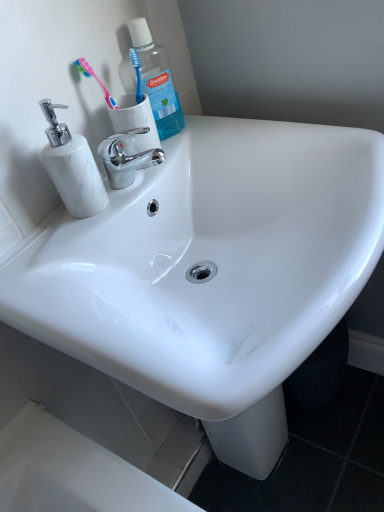
Measure the distance between white glossy sink at center and camera.

white glossy sink at center and camera are 16.32 inches apart from each other.

Locate an element on the screen. chrome/metallic faucet at center is located at coordinates [x=127, y=156].

Is white glossy sink at center positioned behind white marble soap dispenser at left?

No, it is in front of white marble soap dispenser at left.

Considering the relative sizes of white glossy sink at center and white marble soap dispenser at left in the image provided, is white glossy sink at center smaller than white marble soap dispenser at left?

Incorrect, white glossy sink at center is not smaller in size than white marble soap dispenser at left.

How many degrees apart are the facing directions of white glossy sink at center and white marble soap dispenser at left?

The facing directions of white glossy sink at center and white marble soap dispenser at left are 1.76 degrees apart.

From a real-world perspective, which is physically below, white glossy sink at center or white marble soap dispenser at left?

white glossy sink at center is physically lower.

From a real-world perspective, is blue translucent plastic mouthwash at upper left physically above white marble soap dispenser at left?

Yes, from a real-world perspective, blue translucent plastic mouthwash at upper left is above white marble soap dispenser at left.

From the image's perspective, does blue translucent plastic mouthwash at upper left appear lower than white marble soap dispenser at left?

Incorrect, from the image's perspective, blue translucent plastic mouthwash at upper left is higher than white marble soap dispenser at left.

At what (x,y) coordinates should I click in order to perform the action: click on cleaning product on the right of the white marble soap dispenser at left. Please return your answer as a coordinate pair (x, y). This screenshot has height=512, width=384. Looking at the image, I should click on (157, 80).

Can you confirm if blue translucent plastic mouthwash at upper left is wider than white marble soap dispenser at left?

No.

Considering the sizes of pink plastic toothbrush at upper left and chrome/metallic faucet at center in the image, is pink plastic toothbrush at upper left bigger or smaller than chrome/metallic faucet at center?

Clearly, pink plastic toothbrush at upper left is smaller in size than chrome/metallic faucet at center.

From the image's perspective, is pink plastic toothbrush at upper left located beneath chrome/metallic faucet at center?

No, from the image's perspective, pink plastic toothbrush at upper left is not below chrome/metallic faucet at center.

Which object is closer to the camera taking this photo, pink plastic toothbrush at upper left or chrome/metallic faucet at center?

chrome/metallic faucet at center is in front.

Which of these two, pink plastic toothbrush at upper left or chrome/metallic faucet at center, stands taller?

Standing taller between the two is pink plastic toothbrush at upper left.

Which of these two, pink plastic toothbrush at upper left or blue translucent plastic mouthwash at upper left, is bigger?

Bigger between the two is blue translucent plastic mouthwash at upper left.

Is pink plastic toothbrush at upper left facing away from blue translucent plastic mouthwash at upper left?

No, pink plastic toothbrush at upper left is not facing the opposite direction of blue translucent plastic mouthwash at upper left.

Considering the relative sizes of pink plastic toothbrush at upper left and blue translucent plastic mouthwash at upper left in the image provided, is pink plastic toothbrush at upper left shorter than blue translucent plastic mouthwash at upper left?

Yes, pink plastic toothbrush at upper left is shorter than blue translucent plastic mouthwash at upper left.

Considering the positions of objects chrome/metallic faucet at center and blue translucent plastic mouthwash at upper left in the image provided, who is more to the right, chrome/metallic faucet at center or blue translucent plastic mouthwash at upper left?

Positioned to the right is blue translucent plastic mouthwash at upper left.

Which of these two, chrome/metallic faucet at center or blue translucent plastic mouthwash at upper left, stands taller?

With more height is blue translucent plastic mouthwash at upper left.

Is blue translucent plastic mouthwash at upper left at the back of chrome/metallic faucet at center?

No.

Is chrome/metallic faucet at center in contact with blue translucent plastic mouthwash at upper left?

chrome/metallic faucet at center is not next to blue translucent plastic mouthwash at upper left, and they're not touching.

Is pink plastic toothbrush at upper left taller than white glossy sink at center?

No, pink plastic toothbrush at upper left is not taller than white glossy sink at center.

Which object is positioned more to the left, pink plastic toothbrush at upper left or white glossy sink at center?

From the viewer's perspective, pink plastic toothbrush at upper left appears more on the left side.

The image size is (384, 512). I want to click on sink in front of the pink plastic toothbrush at upper left, so click(212, 272).

How much distance is there between pink plastic toothbrush at upper left and white glossy sink at center?

14.35 inches.

Does blue translucent plastic mouthwash at upper left come in front of pink plastic toothbrush at upper left?

No, blue translucent plastic mouthwash at upper left is further to the viewer.

Can we say blue translucent plastic mouthwash at upper left lies outside pink plastic toothbrush at upper left?

blue translucent plastic mouthwash at upper left lies outside pink plastic toothbrush at upper left's area.

Is blue translucent plastic mouthwash at upper left placed right next to pink plastic toothbrush at upper left?

No.

Locate an element on the screen. sink lying on the right of white marble soap dispenser at left is located at coordinates (212, 272).

This screenshot has width=384, height=512. What are the coordinates of `soap dispenser that appears on the left of blue translucent plastic mouthwash at upper left` in the screenshot? It's located at (72, 167).

When comparing their distances from white glossy sink at center, does chrome/metallic faucet at center or pink plastic toothbrush at upper left seem closer?

chrome/metallic faucet at center lies closer to white glossy sink at center than the other object.

Based on their spatial positions, is chrome/metallic faucet at center or pink plastic toothbrush at upper left further from blue translucent plastic mouthwash at upper left?

The object further to blue translucent plastic mouthwash at upper left is chrome/metallic faucet at center.

Which object lies further to the anchor point pink plastic toothbrush at upper left, white marble soap dispenser at left or chrome/metallic faucet at center?

The object further to pink plastic toothbrush at upper left is white marble soap dispenser at left.

Looking at the image, which one is located closer to blue translucent plastic mouthwash at upper left, white marble soap dispenser at left or pink plastic toothbrush at upper left?

pink plastic toothbrush at upper left.

Estimate the real-world distances between objects in this image. Which object is closer to pink plastic toothbrush at upper left, white glossy sink at center or white marble soap dispenser at left?

white marble soap dispenser at left is closer to pink plastic toothbrush at upper left.

From the image, which object appears to be nearer to white marble soap dispenser at left, white glossy sink at center or chrome/metallic faucet at center?

Based on the image, chrome/metallic faucet at center appears to be nearer to white marble soap dispenser at left.

Looking at the image, which one is located further to white marble soap dispenser at left, white glossy sink at center or blue translucent plastic mouthwash at upper left?

Among the two, white glossy sink at center is located further to white marble soap dispenser at left.

From the picture: Based on their spatial positions, is blue translucent plastic mouthwash at upper left or white glossy sink at center closer to white marble soap dispenser at left?

Based on the image, blue translucent plastic mouthwash at upper left appears to be nearer to white marble soap dispenser at left.

You are a GUI agent. You are given a task and a screenshot of the screen. Output one action in this format:
    pyautogui.click(x=<x>, y=<y>)
    Task: Click on the soap dispenser between chrome/metallic faucet at center and white glossy sink at center from top to bottom
    
    Given the screenshot: What is the action you would take?
    pyautogui.click(x=72, y=167)

Identify the location of soap dispenser between pink plastic toothbrush at upper left and white glossy sink at center vertically. This screenshot has width=384, height=512. (72, 167).

I want to click on toothbrush between blue translucent plastic mouthwash at upper left and chrome/metallic faucet at center in the vertical direction, so click(x=94, y=78).

At what (x,y) coordinates should I click in order to perform the action: click on tap that lies between pink plastic toothbrush at upper left and white marble soap dispenser at left from top to bottom. Please return your answer as a coordinate pair (x, y). Looking at the image, I should click on coord(127,156).